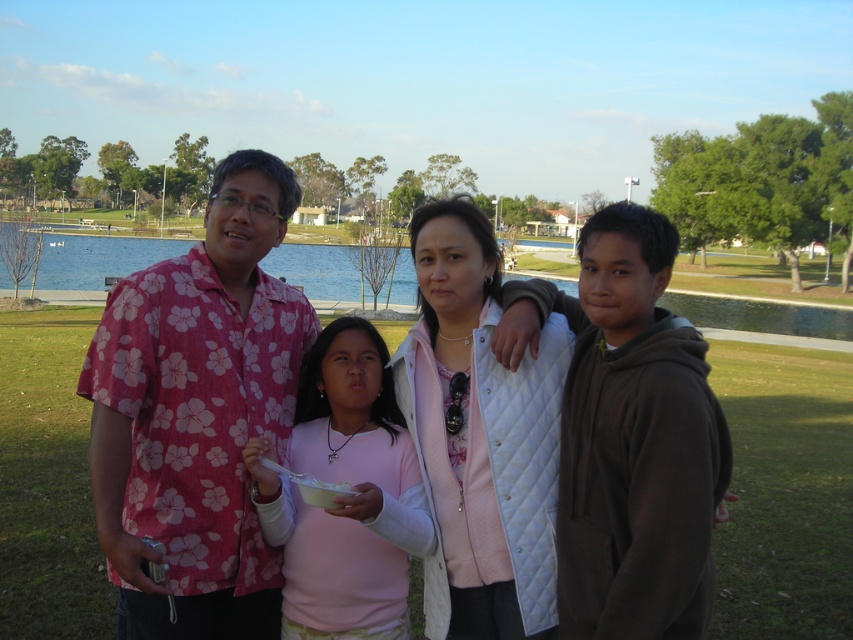
Is brown quilted jacket at right above green water at center?

No.

Does brown quilted jacket at right have a larger size compared to green water at center?

No, brown quilted jacket at right is not bigger than green water at center.

Which is behind, point (712, 404) or point (274, 268)?

The point (274, 268) is behind.

At what (x,y) coordinates should I click in order to perform the action: click on brown quilted jacket at right. Please return your answer as a coordinate pair (x, y). The height and width of the screenshot is (640, 853). Looking at the image, I should click on (628, 435).

Is white quilted vest at center wider than pink fabric shirt at center?

No.

Can you confirm if white quilted vest at center is positioned to the left of pink fabric shirt at center?

No, white quilted vest at center is not to the left of pink fabric shirt at center.

In order to click on white quilted vest at center in this screenshot , I will do `click(479, 436)`.

Is pink floral shirt at center positioned behind pink floral shirt at left?

Yes, pink floral shirt at center is behind pink floral shirt at left.

Find the location of a particular element. pink floral shirt at center is located at coordinates (196, 413).

Measure the distance between pink floral shirt at center and camera.

pink floral shirt at center and camera are 2.73 meters apart from each other.

You are a GUI agent. You are given a task and a screenshot of the screen. Output one action in this format:
    pyautogui.click(x=<x>, y=<y>)
    Task: Click on the pink floral shirt at center
    The height and width of the screenshot is (640, 853).
    Given the screenshot: What is the action you would take?
    pyautogui.click(x=196, y=413)